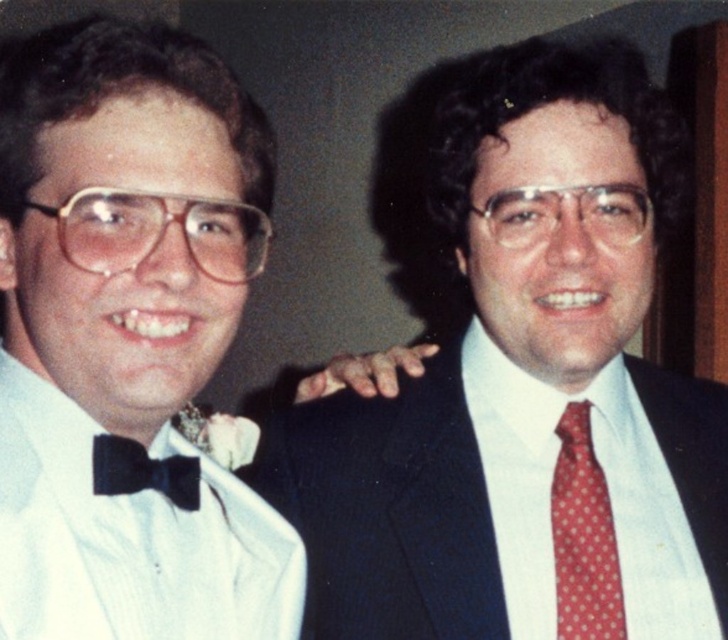
You are a photographer adjusting the lighting for a portrait of the two people. You need to ensure that the white satin bow tie at left and the red dotted fabric tie at right are both clearly visible. Since the bow tie is in front of the tie, which one might you need to adjust the lighting on more to ensure it stands out?

The white satin bow tie at left is in front of the red dotted fabric tie at right, so you should adjust the lighting on the red dotted fabric tie at right more to ensure it stands out, as it might be partially obscured by the bow tie.

You are a photographer setting up for a group photo. You have a 40 cm wide backdrop that needs to have both the red dotted fabric tie at right and the black satin bow tie at left visible without overlapping. Can both ties fit side by side on the backdrop?

The red dotted fabric tie at right is 38.60 centimeters from the black satin bow tie at left, so they can fit side by side on the 40 cm backdrop since the distance between them is less than the backdrop width.

You are a photographer adjusting the camera settings for a portrait of the two people. You notice the red dotted fabric tie at right and the black satin bow tie at left. Which tie should you focus on to ensure it appears larger in the photo?

The red dotted fabric tie at right is taller than the black satin bow tie at left, so focusing on the red dotted fabric tie at right will make it appear larger in the photo.